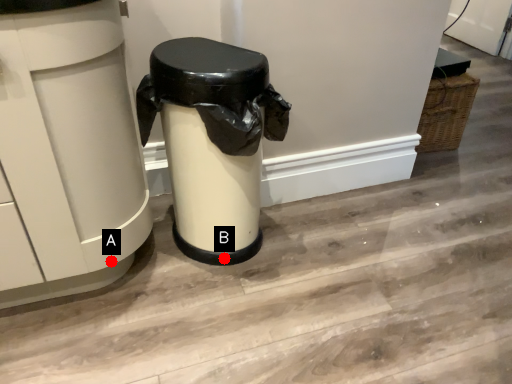
Question: Two points are circled on the image, labeled by A and B beside each circle. Which point is closer to the camera taking this photo?

Choices:
 (A) A is closer
 (B) B is closer

Answer: (A)